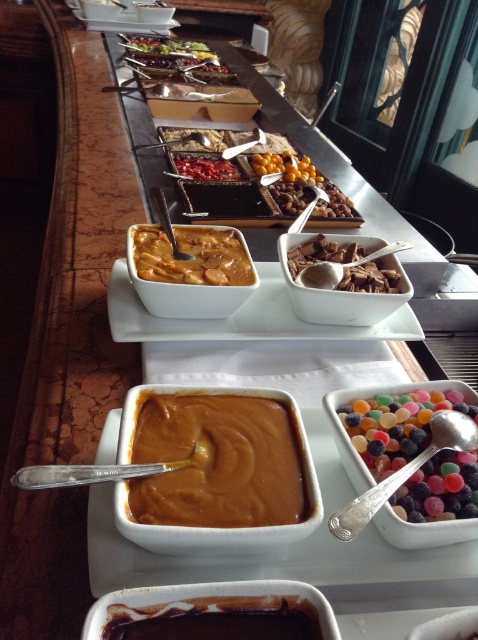
Question: Where is dark glossy pudding at lower center located in relation to chocolate-dipped chocolate at center in the image?

Choices:
 (A) above
 (B) below

Answer: (B)

Question: Is the position of smooth caramel pudding at center less distant than that of savory brown sauce at center?

Choices:
 (A) no
 (B) yes

Answer: (B)

Question: Which of the following is the closest to the observer?

Choices:
 (A) (387, 419)
 (B) (173, 140)
 (C) (355, 252)
 (D) (210, 161)

Answer: (A)

Question: Based on their relative distances, which object is farther from the translucent jelly beans at center?

Choices:
 (A) smooth caramel pudding at center
 (B) savory brown sauce at center
 (C) chocolate-dipped chocolate at center
 (D) savory meat at center

Answer: (D)

Question: Where is savory brown sauce at center located in relation to chocolate-dipped chocolate at center in the image?

Choices:
 (A) below
 (B) above

Answer: (B)

Question: Among these points, which one is nearest to the camera?

Choices:
 (A) (438, 436)
 (B) (293, 632)
 (C) (220, 141)

Answer: (B)